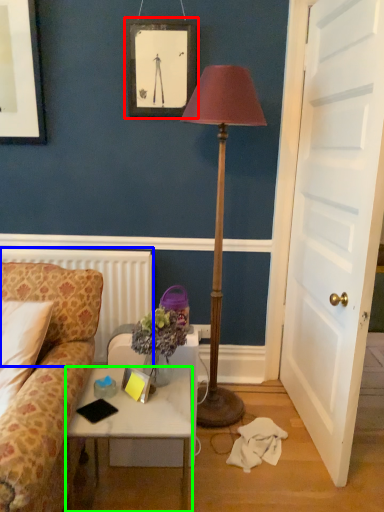
Question: Which object is positioned farthest from picture frame (highlighted by a red box)? Select from radiator (highlighted by a blue box) and desk (highlighted by a green box).

Choices:
 (A) radiator
 (B) desk

Answer: (B)